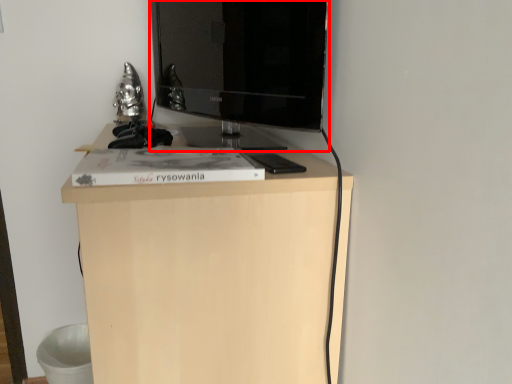
Question: In this image, where is television (annotated by the red box) located relative to furniture?

Choices:
 (A) right
 (B) left

Answer: (A)